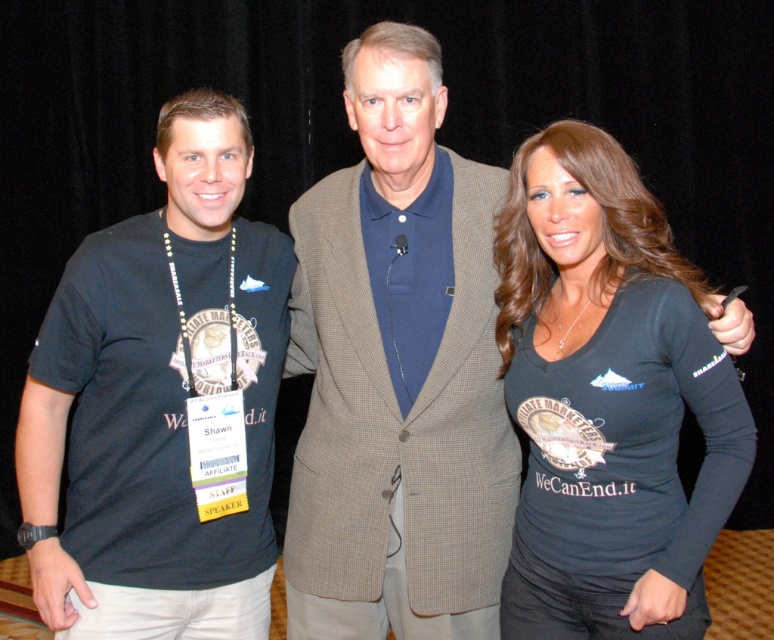
Question: Is blue cotton polo shirt at center above black t-shirt at left?

Choices:
 (A) no
 (B) yes

Answer: (B)

Question: Is blue cotton polo shirt at center positioned before black matte shirt at right?

Choices:
 (A) yes
 (B) no

Answer: (B)

Question: Which point is closer to the camera?

Choices:
 (A) black t-shirt at left
 (B) blue cotton polo shirt at center
 (C) black matte shirt at right

Answer: (C)

Question: Estimate the real-world distances between objects in this image. Which object is farther from the blue cotton polo shirt at center?

Choices:
 (A) black matte shirt at right
 (B) black t-shirt at left

Answer: (B)

Question: Does black t-shirt at left have a larger size compared to black matte shirt at right?

Choices:
 (A) yes
 (B) no

Answer: (A)

Question: Which object is positioned closest to the blue cotton polo shirt at center?

Choices:
 (A) black t-shirt at left
 (B) black matte shirt at right

Answer: (B)